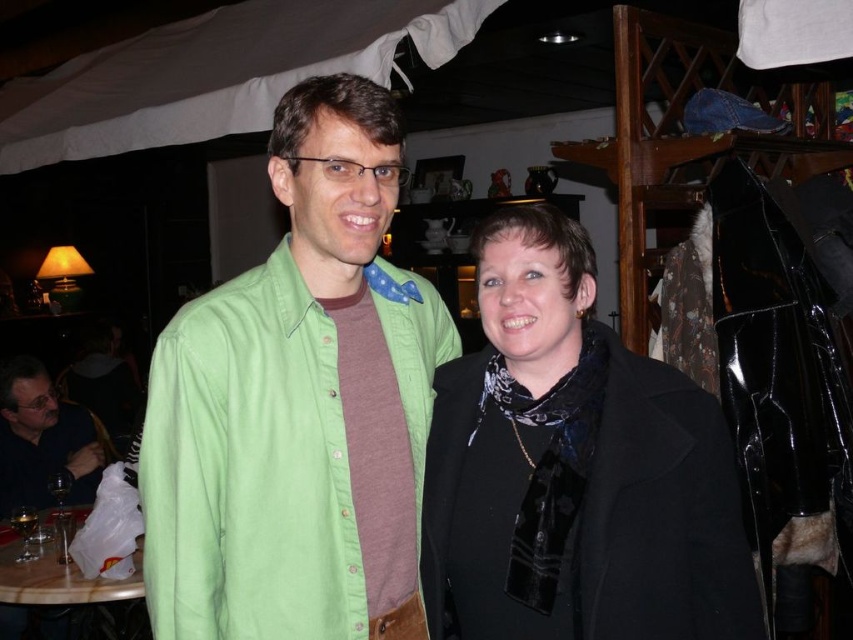
Question: Is green cotton shirt at center to the left of black matte coat at center from the viewer's perspective?

Choices:
 (A) no
 (B) yes

Answer: (B)

Question: Estimate the real-world distances between objects in this image. Which object is farther from the green cotton shirt at center?

Choices:
 (A) black matte coat at center
 (B) matte black jacket at lower left

Answer: (B)

Question: Does black matte coat at center lie in front of matte black jacket at lower left?

Choices:
 (A) yes
 (B) no

Answer: (A)

Question: Which point is farther to the camera?

Choices:
 (A) green cotton shirt at center
 (B) black matte coat at center

Answer: (B)

Question: Where is green cotton shirt at center located in relation to black matte coat at center in the image?

Choices:
 (A) left
 (B) right

Answer: (A)

Question: Which point is farther from the camera taking this photo?

Choices:
 (A) click(x=15, y=502)
 (B) click(x=149, y=531)
 (C) click(x=532, y=337)

Answer: (A)